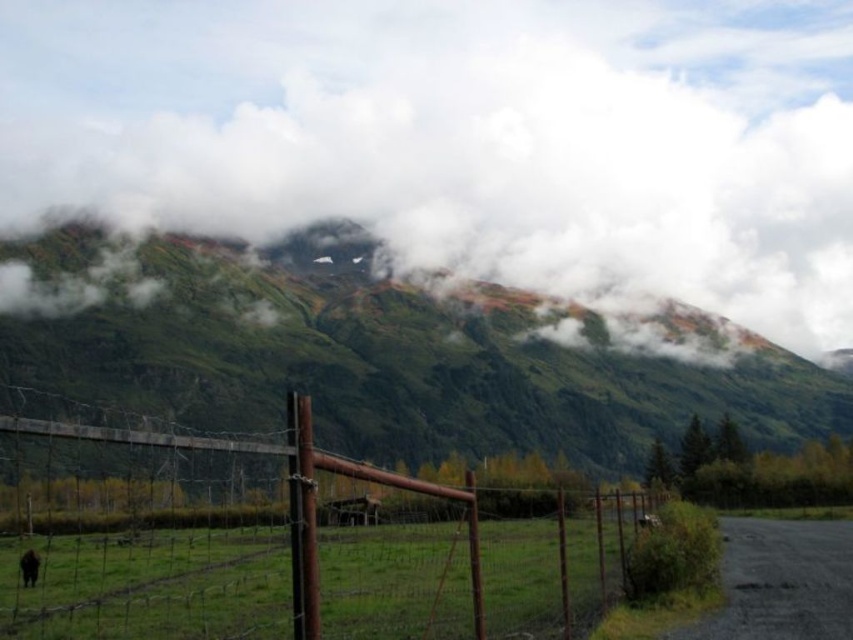
You are standing at the edge of the road and see the green grassy hill at center and the rusty wire fence at center. Which object would appear closer to you if you look straight ahead?

The rusty wire fence at center is closer to you than the green grassy hill at center because the fence is at the center while the hill is further back.

You are standing at the lower left corner of the image where the brown furry dog at lower left is located. You want to walk towards the green grassy hill at center. In which direction should you move?

You should move to the right since the green grassy hill at center is to the right of the brown furry dog at lower left.